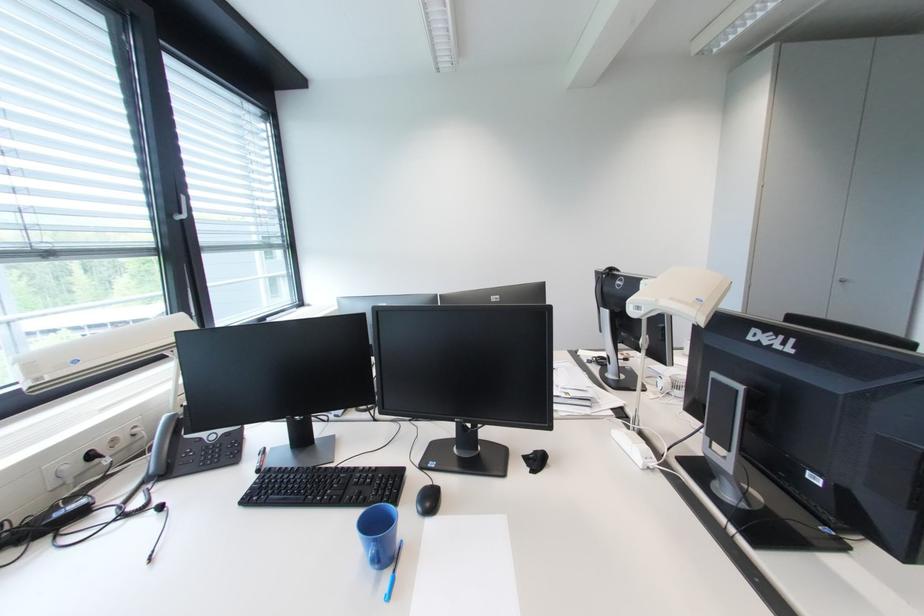
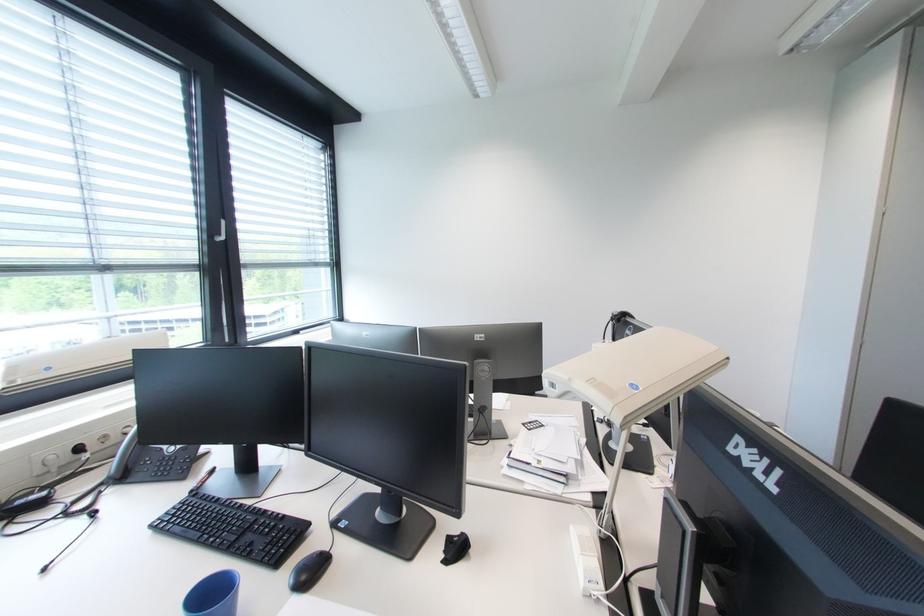
Locate, in the second image, the point that corresponds to point 176,217 in the first image.

(217, 238)